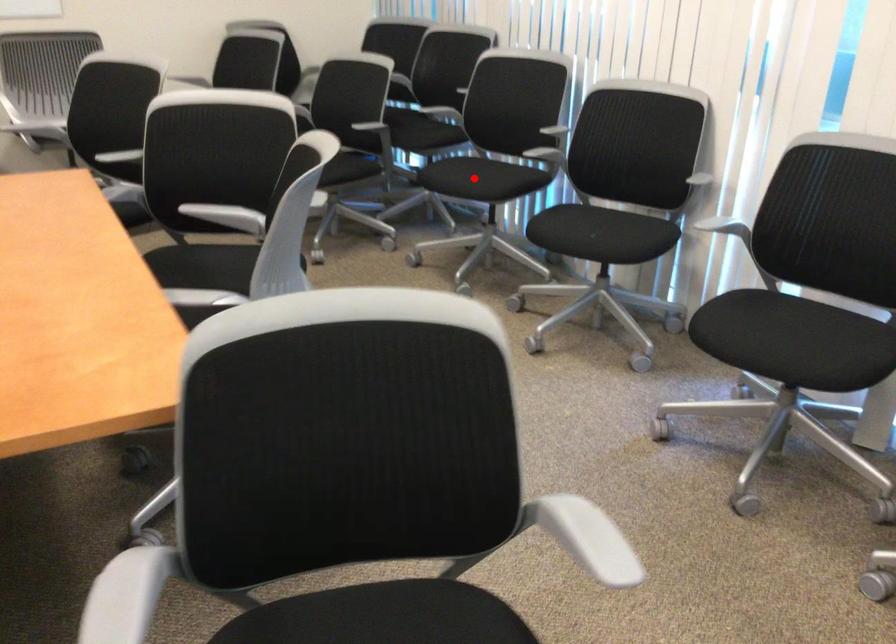
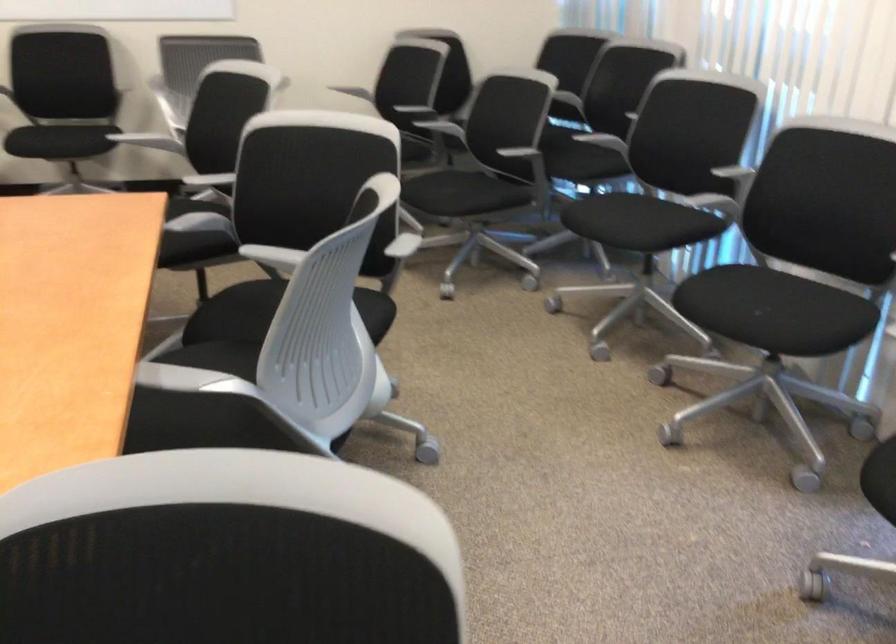
Question: I am providing you with two images of the same scene from different viewpoints. A red point is shown in image1. For the corresponding object point in image2, is it positioned nearer or farther from the camera?

Choices:
 (A) Nearer
 (B) Farther

Answer: (A)